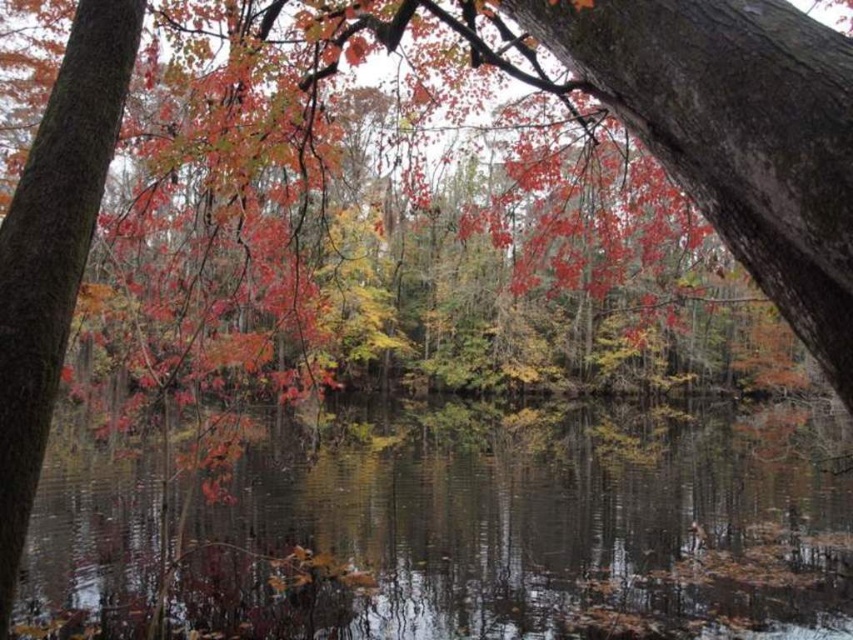
Who is lower down, smooth reflective water at center or smooth bark tree trunk at left?

smooth reflective water at center is lower down.

Is point (482, 449) closer to camera compared to point (9, 573)?

No, (482, 449) is further to viewer.

You are a GUI agent. You are given a task and a screenshot of the screen. Output one action in this format:
    pyautogui.click(x=<x>, y=<y>)
    Task: Click on the smooth reflective water at center
    The width and height of the screenshot is (853, 640).
    Given the screenshot: What is the action you would take?
    pyautogui.click(x=473, y=528)